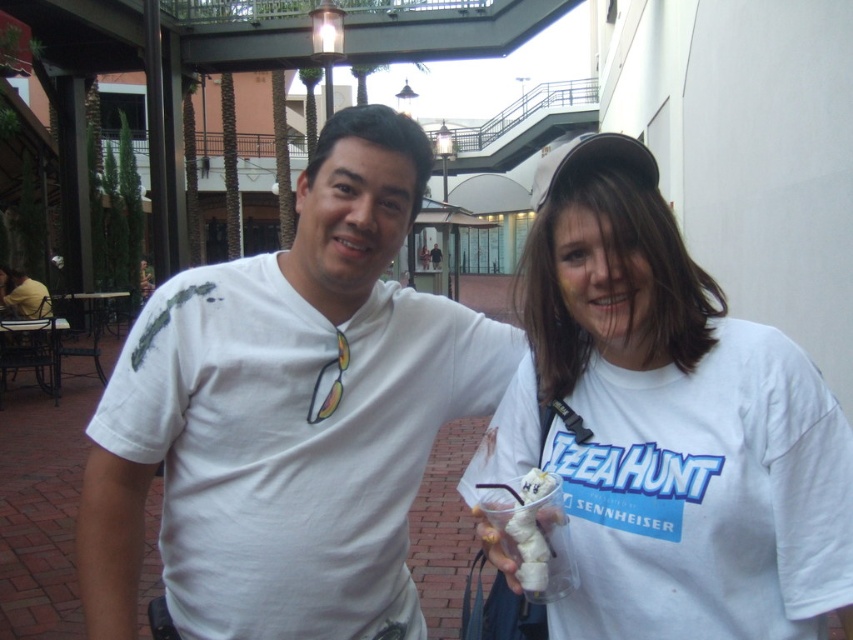
Consider the image. Does white matte t-shirt at center appear on the right side of white cotton t-shirt at center?

Incorrect, white matte t-shirt at center is not on the right side of white cotton t-shirt at center.

Who is higher up, white matte t-shirt at center or white cotton t-shirt at center?

Positioned higher is white cotton t-shirt at center.

Between point (314, 557) and point (729, 602), which one is positioned behind?

The point (314, 557) is behind.

Locate an element on the screen. The width and height of the screenshot is (853, 640). white matte t-shirt at center is located at coordinates (288, 416).

How far apart are white creamy ice cream at center and matte white shirt at left?

The distance of white creamy ice cream at center from matte white shirt at left is 12.43 meters.

Can you confirm if white creamy ice cream at center is taller than matte white shirt at left?

Incorrect, white creamy ice cream at center's height is not larger of matte white shirt at left's.

Locate an element on the screen. The width and height of the screenshot is (853, 640). white creamy ice cream at center is located at coordinates tap(532, 531).

Locate an element on the screen. white creamy ice cream at center is located at coordinates (532, 531).

Is white matte t-shirt at center shorter than matte white shirt at left?

No, white matte t-shirt at center is not shorter than matte white shirt at left.

From the picture: Between white matte t-shirt at center and matte white shirt at left, which one appears on the right side from the viewer's perspective?

white matte t-shirt at center

At what (x,y) coordinates should I click in order to perform the action: click on white matte t-shirt at center. Please return your answer as a coordinate pair (x, y). The image size is (853, 640). Looking at the image, I should click on (288, 416).